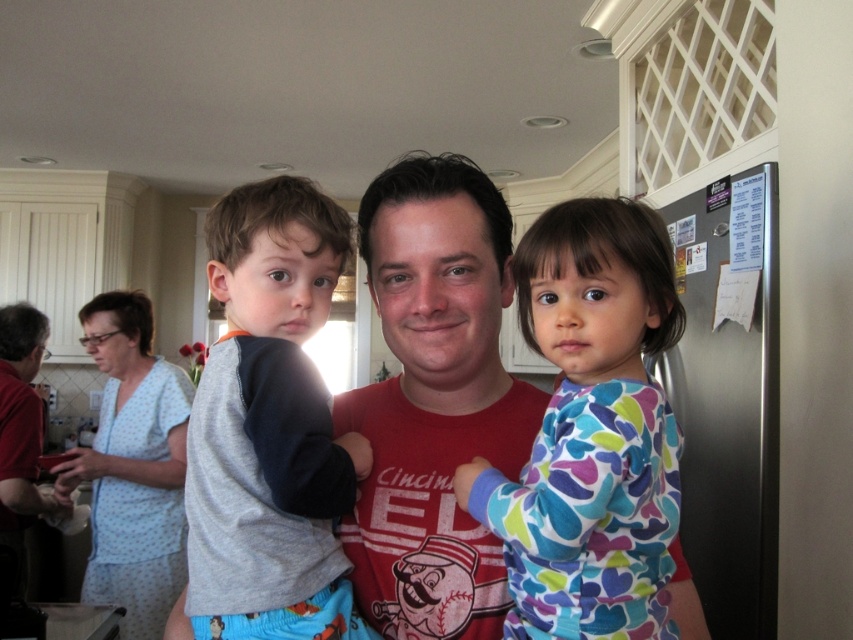
Question: Which object is farther from the camera taking this photo?

Choices:
 (A) light blue dotted dress at left
 (B) gray fleece shirt at center

Answer: (A)

Question: Does multicolored fleece pajamas at right appear under gray fleece shirt at center?

Choices:
 (A) yes
 (B) no

Answer: (A)

Question: Is multicolored fleece pajamas at right in front of gray fleece shirt at center?

Choices:
 (A) yes
 (B) no

Answer: (A)

Question: Based on their relative distances, which object is nearer to the gray fleece shirt at center?

Choices:
 (A) light blue dotted dress at left
 (B) multicolored fleece pajamas at right

Answer: (B)

Question: Is gray fleece shirt at center positioned behind light blue dotted dress at left?

Choices:
 (A) no
 (B) yes

Answer: (A)

Question: Considering the real-world distances, which object is closest to the light blue dotted dress at left?

Choices:
 (A) multicolored fleece pajamas at right
 (B) gray fleece shirt at center

Answer: (B)